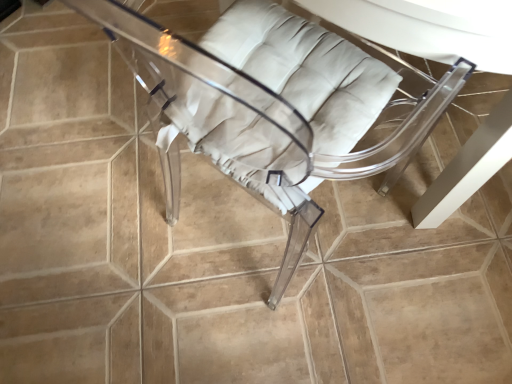
Locate an element on the screen. The width and height of the screenshot is (512, 384). vacant region under clear acrylic chair at center (from a real-world perspective) is located at coordinates (237, 241).